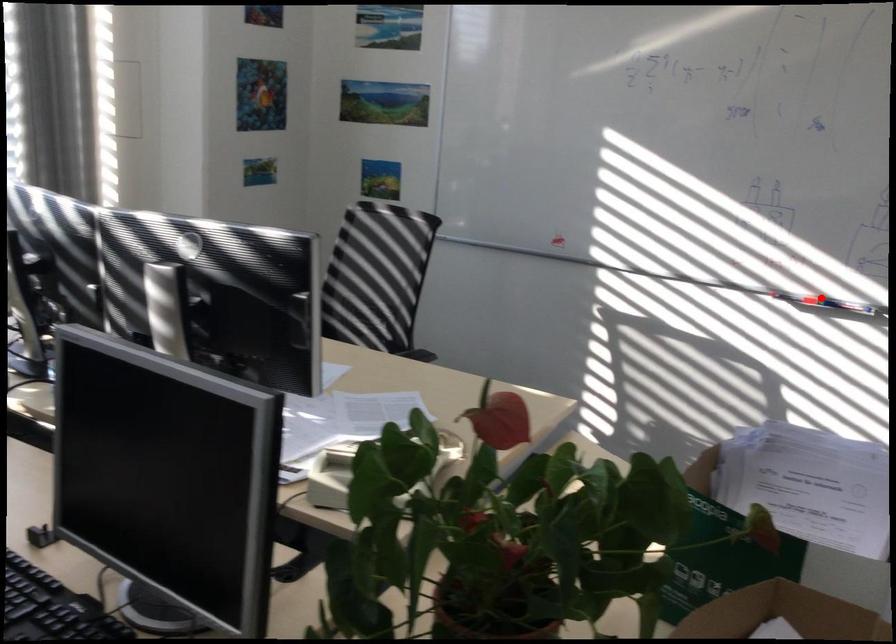
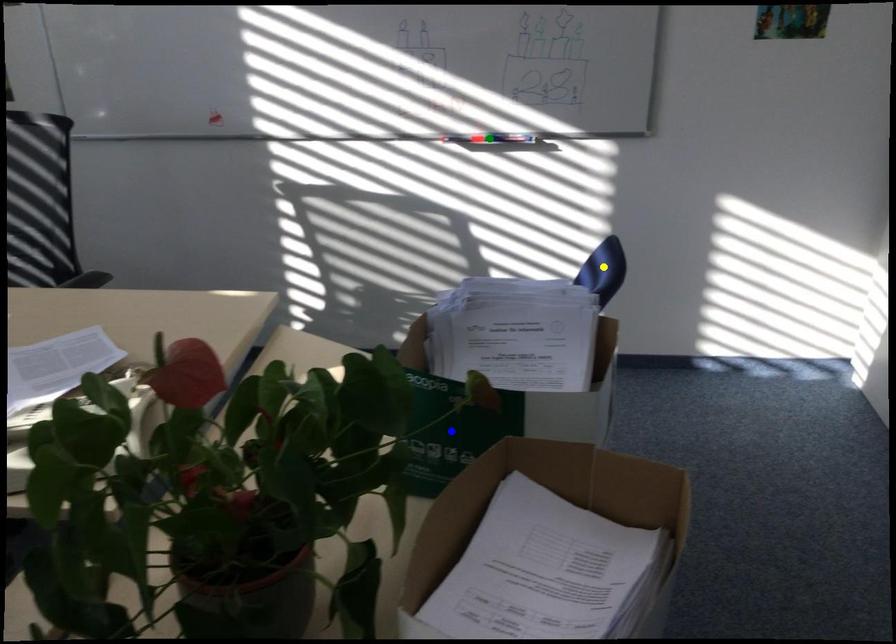
Question: I am providing you with two images of the same scene from different viewpoints. A red point is marked on the first image. You are given multiple points on the second image. In image 2, which mark is for the same physical point as the one in image 1?

Choices:
 (A) blue point
 (B) green point
 (C) yellow point

Answer: (B)